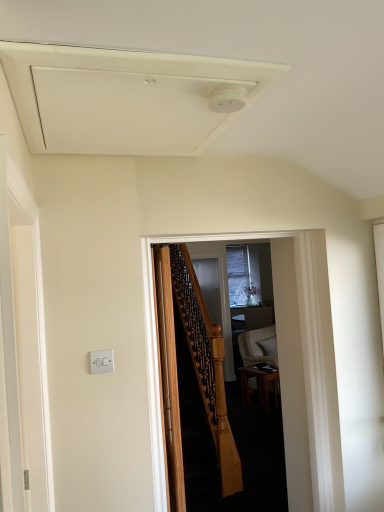
Question: From the image's perspective, does wooden table at center appear higher than clear glass screen door at center, marked as the first screen door in a back-to-front arrangement?

Choices:
 (A) no
 (B) yes

Answer: (A)

Question: Is clear glass screen door at center, marked as the first screen door in a back-to-front arrangement, at the back of wooden table at center?

Choices:
 (A) yes
 (B) no

Answer: (B)

Question: Is wooden table at center positioned in front of clear glass screen door at center, the 2th screen door positioned from the left?

Choices:
 (A) yes
 (B) no

Answer: (A)

Question: Is wooden table at center bigger than clear glass screen door at center, marked as the 2th screen door in a front-to-back arrangement?

Choices:
 (A) yes
 (B) no

Answer: (A)

Question: Is wooden table at center beside clear glass screen door at center, marked as the 2th screen door in a front-to-back arrangement?

Choices:
 (A) no
 (B) yes

Answer: (A)

Question: Visually, is wooden table at center positioned to the left or to the right of wooden staircase at center?

Choices:
 (A) left
 (B) right

Answer: (B)

Question: Relative to wooden staircase at center, is wooden table at center in front or behind?

Choices:
 (A) behind
 (B) front

Answer: (A)

Question: Looking at the image, does wooden table at center seem bigger or smaller compared to wooden staircase at center?

Choices:
 (A) big
 (B) small

Answer: (B)

Question: Considering the positions of wooden table at center and wooden staircase at center in the image, is wooden table at center taller or shorter than wooden staircase at center?

Choices:
 (A) tall
 (B) short

Answer: (B)

Question: In terms of height, does white matte exhaust hood at upper center look taller or shorter compared to wooden staircase at center?

Choices:
 (A) tall
 (B) short

Answer: (B)

Question: From a real-world perspective, is white matte exhaust hood at upper center positioned above or below wooden staircase at center?

Choices:
 (A) above
 (B) below

Answer: (A)

Question: Is point (79, 106) positioned closer to the camera than point (281, 251)?

Choices:
 (A) farther
 (B) closer

Answer: (B)

Question: Is white matte exhaust hood at upper center situated inside wooden staircase at center or outside?

Choices:
 (A) outside
 (B) inside

Answer: (A)

Question: Visually, is wooden door at center positioned to the left or to the right of clear glass screen door at center, marked as the first screen door in a back-to-front arrangement?

Choices:
 (A) left
 (B) right

Answer: (A)

Question: Considering the positions of wooden door at center and clear glass screen door at center, marked as the 2th screen door in a front-to-back arrangement, in the image, is wooden door at center bigger or smaller than clear glass screen door at center, marked as the 2th screen door in a front-to-back arrangement,?

Choices:
 (A) small
 (B) big

Answer: (B)